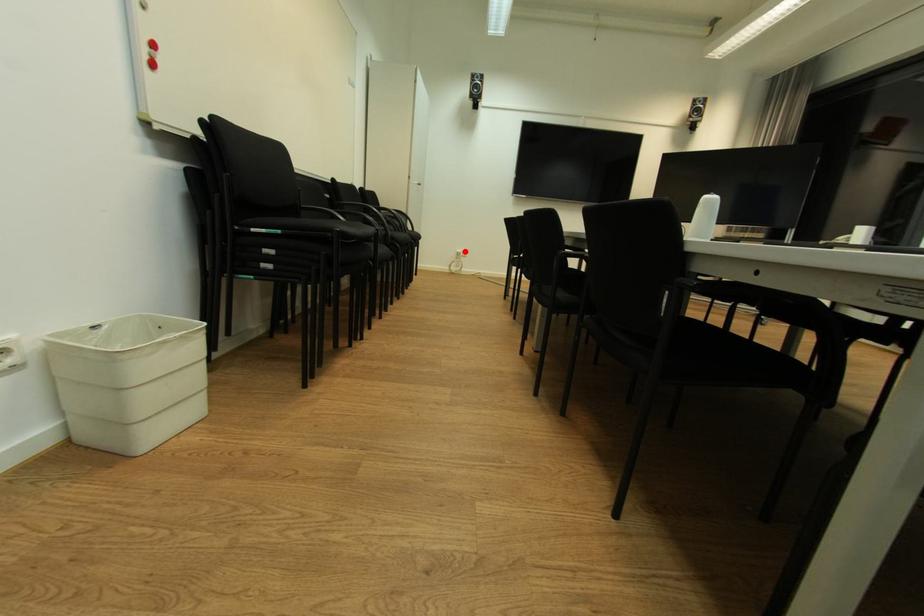
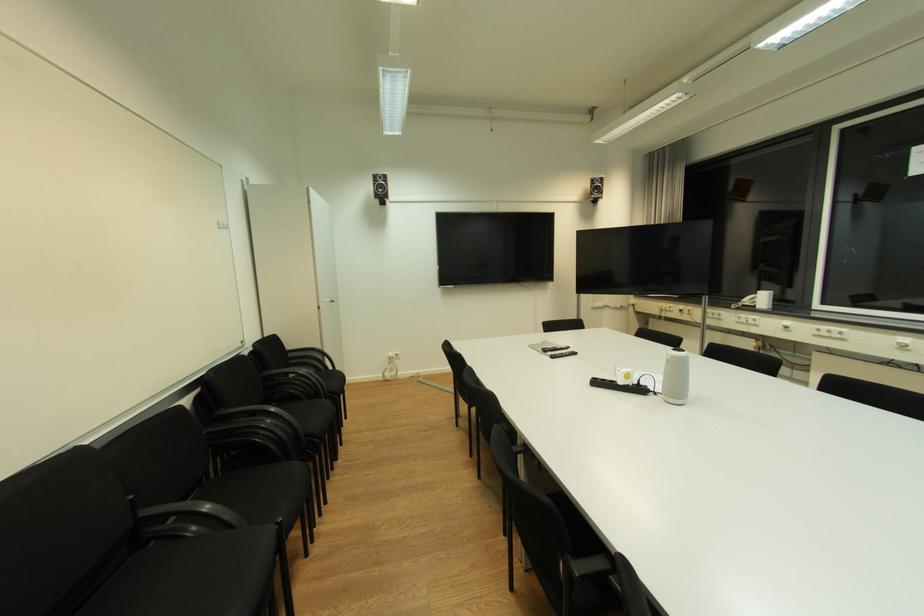
The point at the highlighted location is marked in the first image. Where is the corresponding point in the second image?

(396, 355)